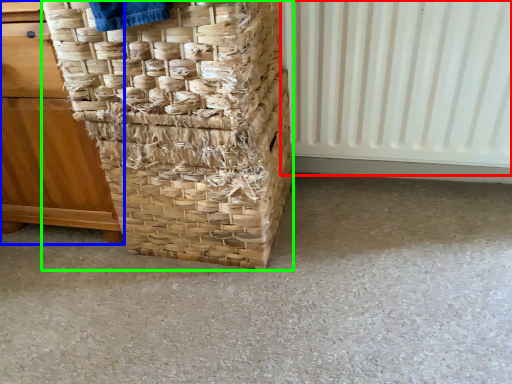
Question: Which object is positioned farthest from radiator (highlighted by a red box)? Select from furniture (highlighted by a blue box) and basket (highlighted by a green box).

Choices:
 (A) furniture
 (B) basket

Answer: (A)